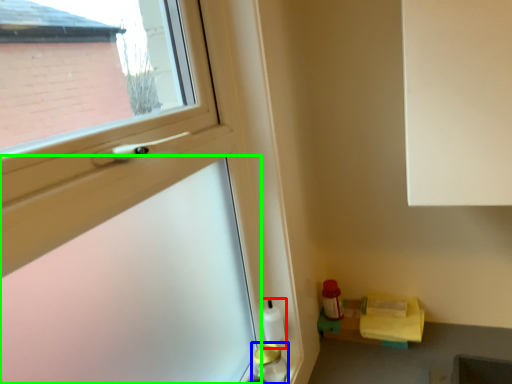
Question: Considering the real-world distances, which object is farthest from bottle (highlighted by a red box)? bottle (highlighted by a blue box) or screen door (highlighted by a green box)?

Choices:
 (A) bottle
 (B) screen door

Answer: (B)